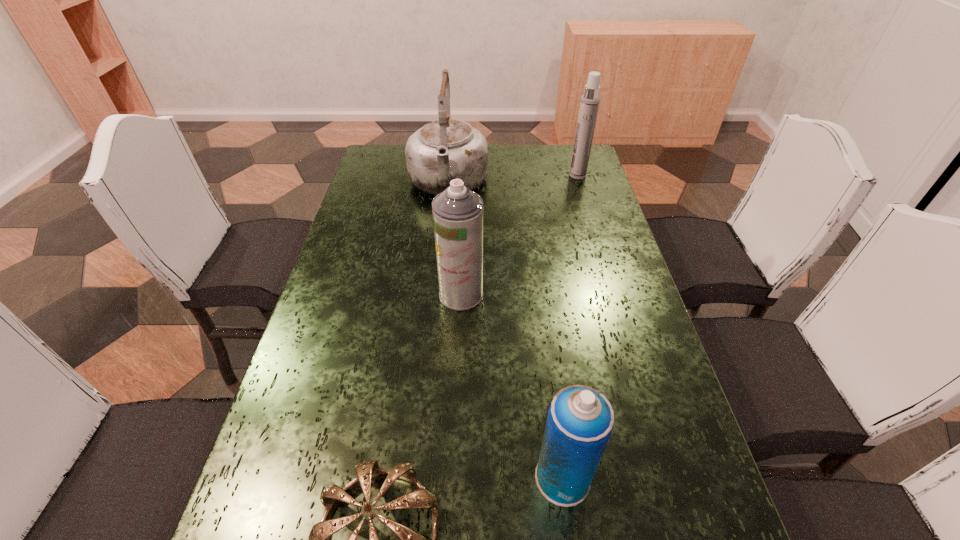
Find the location of a particular element. The height and width of the screenshot is (540, 960). the farthest aerosol can is located at coordinates (589, 104).

Where is `the rightmost object`? the rightmost object is located at coordinates (589, 104).

You are a GUI agent. You are given a task and a screenshot of the screen. Output one action in this format:
    pyautogui.click(x=<x>, y=<y>)
    Task: Click on the kettle
    Image resolution: width=960 pixels, height=540 pixels.
    Given the screenshot: What is the action you would take?
    pyautogui.click(x=447, y=149)

I want to click on the third farthest object, so click(x=458, y=213).

Find the location of a particular element. Image resolution: width=960 pixels, height=540 pixels. the leftmost aerosol can is located at coordinates (458, 213).

Identify the location of the shortest aerosol can. (580, 419).

The width and height of the screenshot is (960, 540). I want to click on the second aerosol can from right to left, so click(580, 419).

The width and height of the screenshot is (960, 540). In order to click on vacant space located 0.080m on the back of the farthest aerosol can in this screenshot , I will do `click(573, 160)`.

This screenshot has height=540, width=960. Identify the location of free space located at the spout of the kettle. (443, 247).

At what (x,y) coordinates should I click in order to perform the action: click on vacant space situated 0.110m on the front of the second farthest aerosol can. Please return your answer as a coordinate pair (x, y). Looking at the image, I should click on (459, 346).